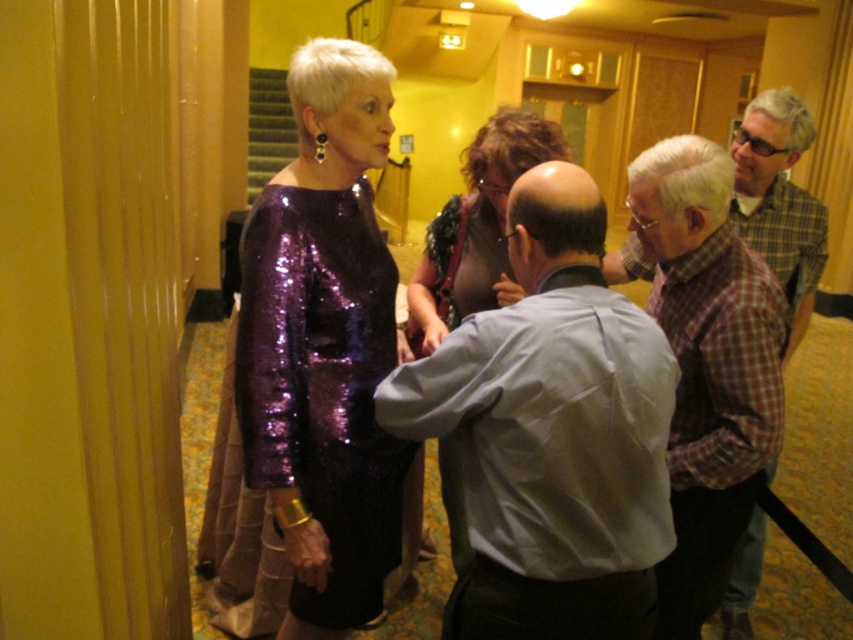
Which is more to the left, sparkly purple dress at center or plaid shirt at right?

From the viewer's perspective, sparkly purple dress at center appears more on the left side.

Between point (358, 310) and point (792, 221), which one is positioned in front?

Point (358, 310)

Find the location of `sparkly purple dress at center`. sparkly purple dress at center is located at coordinates (322, 388).

Can you confirm if shiny purple dress at center is positioned to the right of plaid shirt at right?

Incorrect, shiny purple dress at center is not on the right side of plaid shirt at right.

Does shiny purple dress at center appear over plaid shirt at right?

Incorrect, shiny purple dress at center is not positioned above plaid shirt at right.

In the scene shown: Who is more forward, (x=463, y=259) or (x=738, y=608)?

Point (x=463, y=259) is more forward.

I want to click on shiny purple dress at center, so click(x=476, y=228).

Is plaid cotton shirt at center further to the viewer compared to shiny purple dress at center?

No.

Is plaid cotton shirt at center smaller than shiny purple dress at center?

Correct, plaid cotton shirt at center occupies less space than shiny purple dress at center.

Image resolution: width=853 pixels, height=640 pixels. I want to click on plaid cotton shirt at center, so click(x=706, y=365).

The width and height of the screenshot is (853, 640). What are the coordinates of `plaid cotton shirt at center` in the screenshot? It's located at (706, 365).